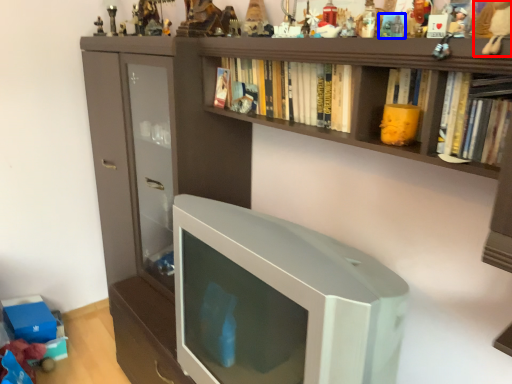
Question: Which of the following is the closest to the observer, toy (highlighted by a red box) or toy (highlighted by a blue box)?

Choices:
 (A) toy
 (B) toy

Answer: (A)